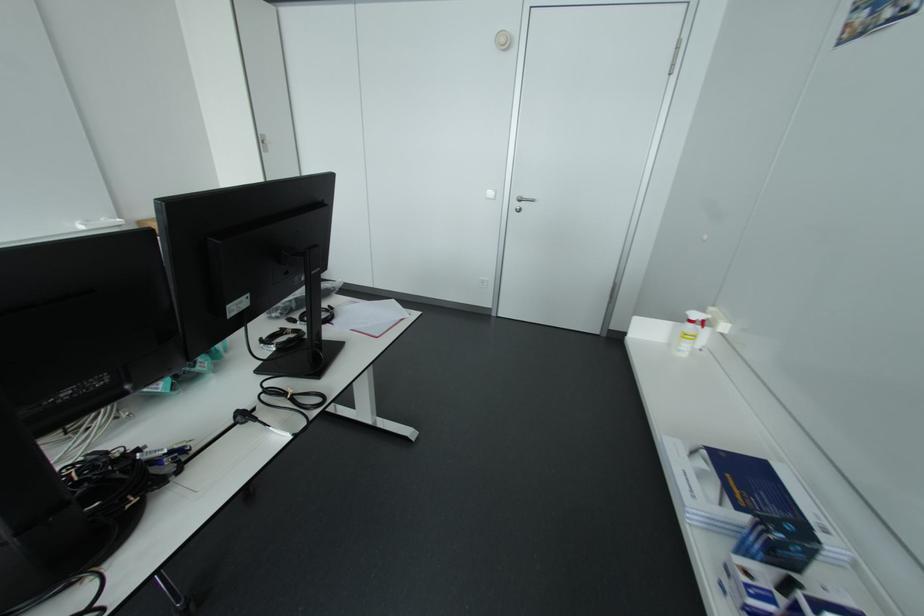
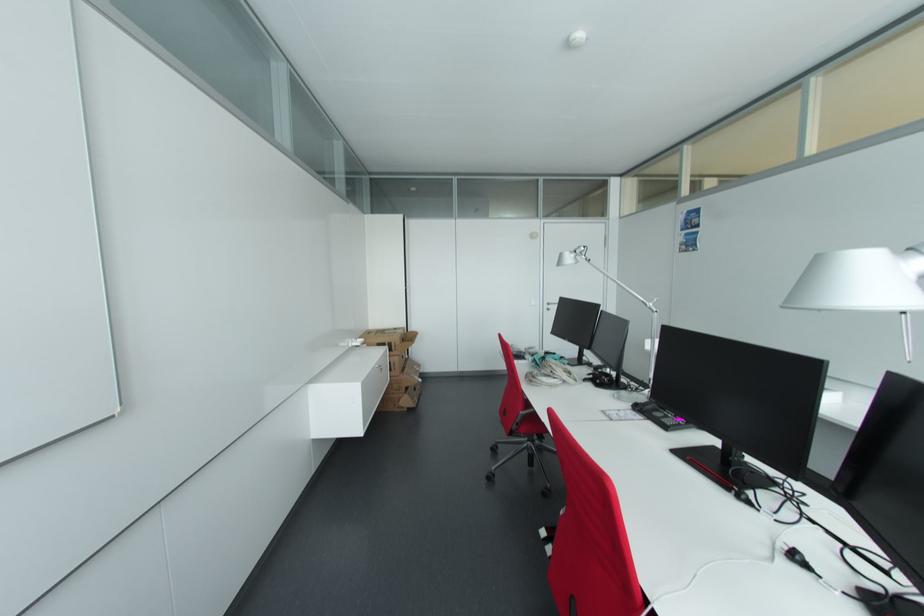
Which direction would the cameraman need to move to produce the second image?

The movement direction of the cameraman is left, backward.